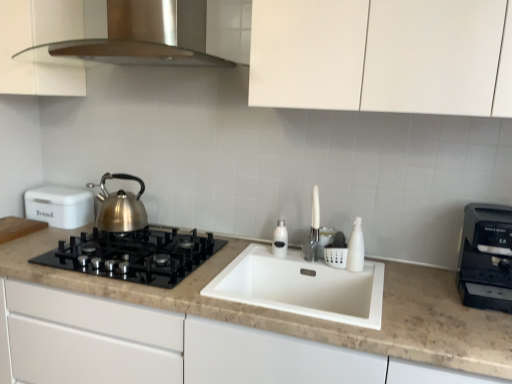
Question: Is satin silver range hood at upper center facing away from black plastic toaster at right, placed as the first kitchen appliance when sorted from right to left?

Choices:
 (A) no
 (B) yes

Answer: (A)

Question: From a real-world perspective, is satin silver range hood at upper center below black plastic toaster at right, arranged as the second kitchen appliance when viewed from the left?

Choices:
 (A) no
 (B) yes

Answer: (A)

Question: Can we say satin silver range hood at upper center lies outside black plastic toaster at right, placed as the first kitchen appliance when sorted from right to left?

Choices:
 (A) yes
 (B) no

Answer: (A)

Question: Considering the relative sizes of satin silver range hood at upper center and black plastic toaster at right, arranged as the second kitchen appliance when viewed from the left, in the image provided, is satin silver range hood at upper center shorter than black plastic toaster at right, arranged as the second kitchen appliance when viewed from the left,?

Choices:
 (A) yes
 (B) no

Answer: (B)

Question: Is black plastic toaster at right, placed as the first kitchen appliance when sorted from right to left, completely or partially inside satin silver range hood at upper center?

Choices:
 (A) no
 (B) yes

Answer: (A)

Question: From their relative heights in the image, would you say white plastic bottle at sink, the 1th bottle when ordered from right to left, is taller or shorter than black plastic toaster at right, placed as the first kitchen appliance when sorted from right to left?

Choices:
 (A) short
 (B) tall

Answer: (A)

Question: Is point (353, 263) positioned closer to the camera than point (478, 244)?

Choices:
 (A) farther
 (B) closer

Answer: (A)

Question: Is white plastic bottle at sink, the 2th bottle when ordered from left to right, in front of or behind black plastic toaster at right, which is the 1th kitchen appliance in front-to-back order, in the image?

Choices:
 (A) behind
 (B) front

Answer: (A)

Question: From the image's perspective, is white plastic bottle at sink, the 1th bottle when ordered from right to left, above or below black plastic toaster at right, arranged as the second kitchen appliance when viewed from the left?

Choices:
 (A) above
 (B) below

Answer: (A)

Question: Considering their positions, is white matte bread bin at left, arranged as the first kitchen appliance when viewed from the left, located in front of or behind satin silver range hood at upper center?

Choices:
 (A) behind
 (B) front

Answer: (A)

Question: From the image's perspective, is white matte bread bin at left, marked as the 2th kitchen appliance in a right-to-left arrangement, above or below satin silver range hood at upper center?

Choices:
 (A) below
 (B) above

Answer: (A)

Question: From a real-world perspective, is white matte bread bin at left, marked as the 2th kitchen appliance in a right-to-left arrangement, physically located above or below satin silver range hood at upper center?

Choices:
 (A) below
 (B) above

Answer: (A)

Question: From their relative heights in the image, would you say white matte bread bin at left, the first kitchen appliance from the back, is taller or shorter than satin silver range hood at upper center?

Choices:
 (A) tall
 (B) short

Answer: (B)

Question: From the image's perspective, is satin silver soap dispenser at sink, acting as the 2th bottle starting from the front, located above or below black glass gas stove at left?

Choices:
 (A) below
 (B) above

Answer: (B)

Question: From a real-world perspective, is satin silver soap dispenser at sink, the 1th bottle in the left-to-right sequence, physically located above or below black glass gas stove at left?

Choices:
 (A) above
 (B) below

Answer: (A)